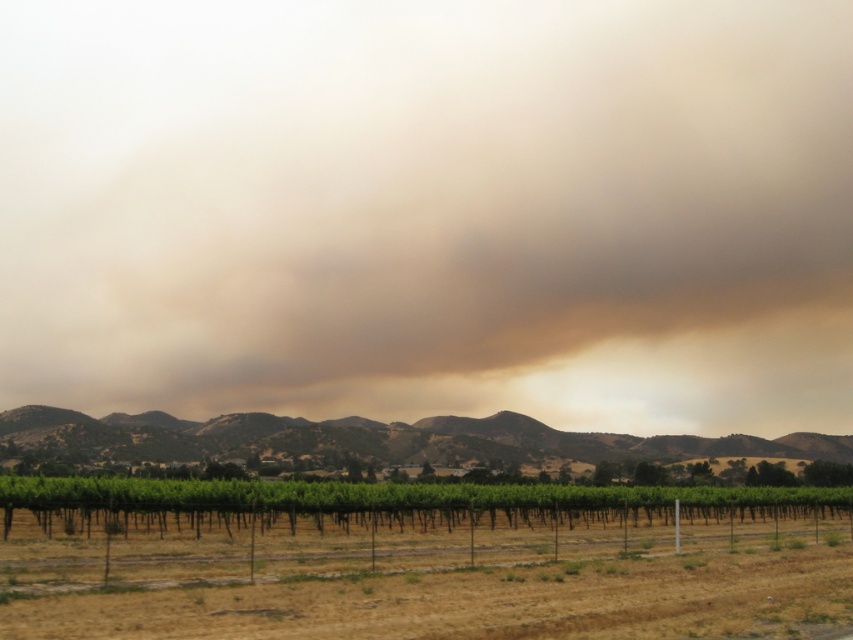
Question: Does brown/dusty cloud at upper center appear on the left side of green grassy hill at center?

Choices:
 (A) no
 (B) yes

Answer: (B)

Question: Which object is closer to the camera taking this photo?

Choices:
 (A) green grassy hill at center
 (B) green leafy vineyard at center
 (C) brown/dusty cloud at upper center

Answer: (B)

Question: Does brown/dusty cloud at upper center appear over green leafy vineyard at center?

Choices:
 (A) yes
 (B) no

Answer: (A)

Question: Which object is the farthest from the green leafy vineyard at center?

Choices:
 (A) brown/dusty cloud at upper center
 (B) green grassy hill at center

Answer: (A)

Question: Which object is the closest to the green grassy hill at center?

Choices:
 (A) green leafy vineyard at center
 (B) brown/dusty cloud at upper center

Answer: (B)

Question: Can you confirm if brown/dusty cloud at upper center is wider than green leafy vineyard at center?

Choices:
 (A) no
 (B) yes

Answer: (B)